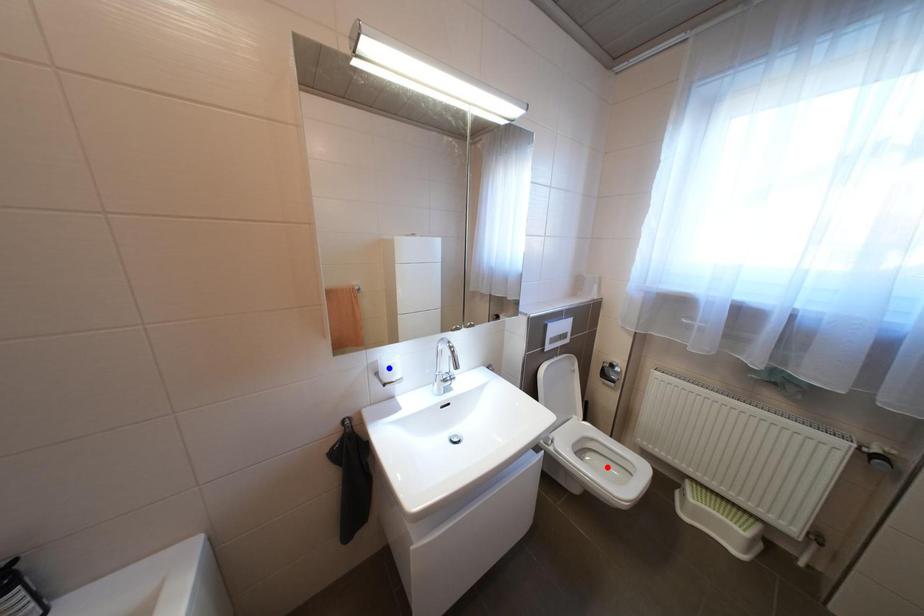
Question: In the image, two points are highlighted. Which point is nearer to the camera? Reply with the corresponding letter.

Choices:
 (A) blue point
 (B) red point

Answer: (A)